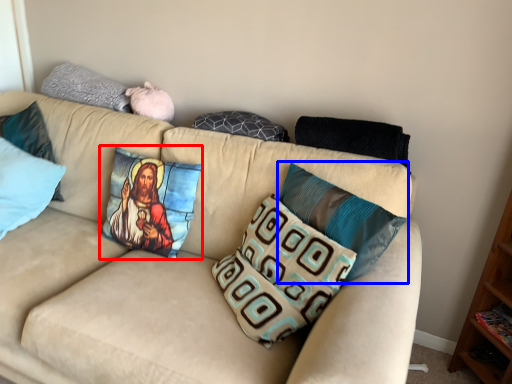
Question: Which object is further to the camera taking this photo, pillow (highlighted by a red box) or pillow (highlighted by a blue box)?

Choices:
 (A) pillow
 (B) pillow

Answer: (A)